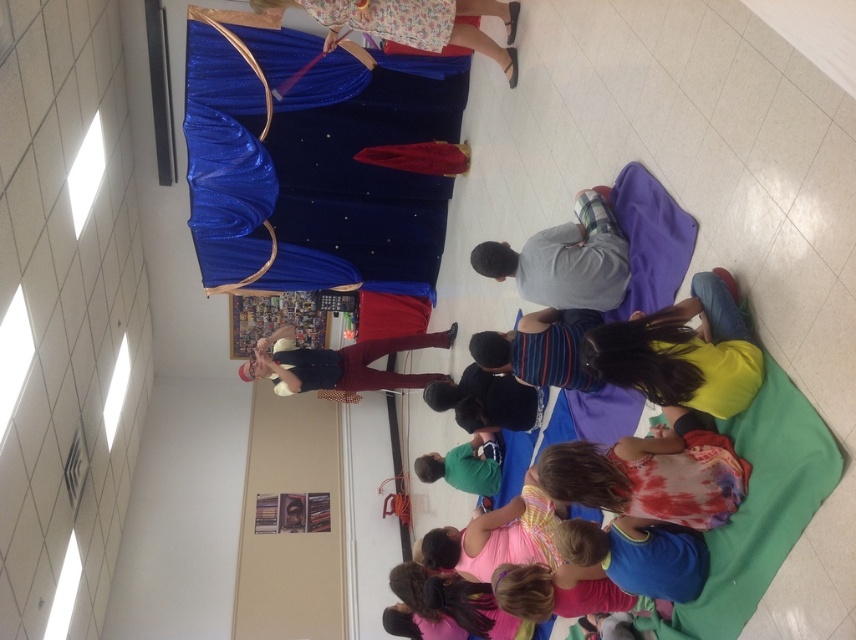
Question: Among these points, which one is nearest to the camera?

Choices:
 (A) (480, 374)
 (B) (479, 448)
 (C) (290, 369)
 (D) (664, 374)

Answer: (D)

Question: Which of the following is the farthest from the observer?

Choices:
 (A) yellow matte shirt at lower right
 (B) floral fabric skirt at upper center

Answer: (B)

Question: Is tie-dye fabric shirt at lower center positioned in front of green cotton shirt at lower center?

Choices:
 (A) no
 (B) yes

Answer: (B)

Question: Can you confirm if tie-dye fabric shirt at lower center is thinner than green cotton shirt at lower center?

Choices:
 (A) yes
 (B) no

Answer: (B)

Question: Is tie-dye fabric shirt at lower center positioned before gray flannel shirt at center?

Choices:
 (A) no
 (B) yes

Answer: (B)

Question: Which point is closer to the camera?

Choices:
 (A) black leather jacket at center
 (B) floral fabric skirt at upper center

Answer: (B)